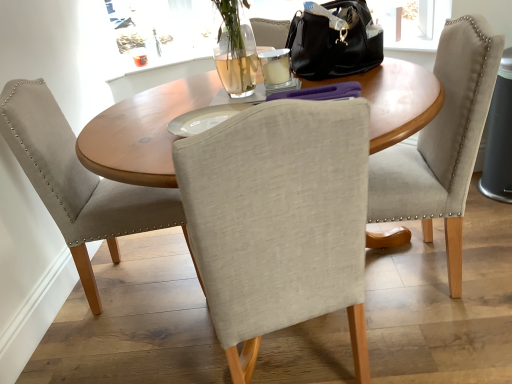
What are the coordinates of `free space on the front side of light gray fabric chair at center, acting as the 2th chair starting from the left` in the screenshot? It's located at (438, 334).